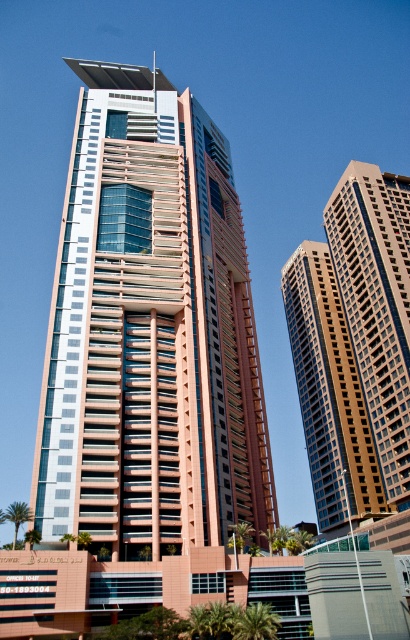
Measure the distance between matte pink glass building at center and brown textured building at right.

The distance of matte pink glass building at center from brown textured building at right is 105.47 feet.

Which is behind, point (152, 193) or point (407, 227)?

Positioned behind is point (407, 227).

Locate an element on the screen. matte pink glass building at center is located at coordinates (150, 333).

Does matte pink glass building at center have a lesser height compared to brown glass building at right?

No.

Does matte pink glass building at center have a lesser width compared to brown glass building at right?

No.

The image size is (410, 640). What do you see at coordinates (150, 333) in the screenshot? I see `matte pink glass building at center` at bounding box center [150, 333].

This screenshot has height=640, width=410. In order to click on matte pink glass building at center in this screenshot , I will do `click(150, 333)`.

This screenshot has width=410, height=640. I want to click on brown textured building at right, so click(377, 305).

Is brown textured building at right above brown glass building at right?

Yes, brown textured building at right is above brown glass building at right.

Between point (389, 394) and point (341, 499), which one is positioned in front?

Point (389, 394) is in front.

Locate an element on the screen. brown textured building at right is located at coordinates (377, 305).